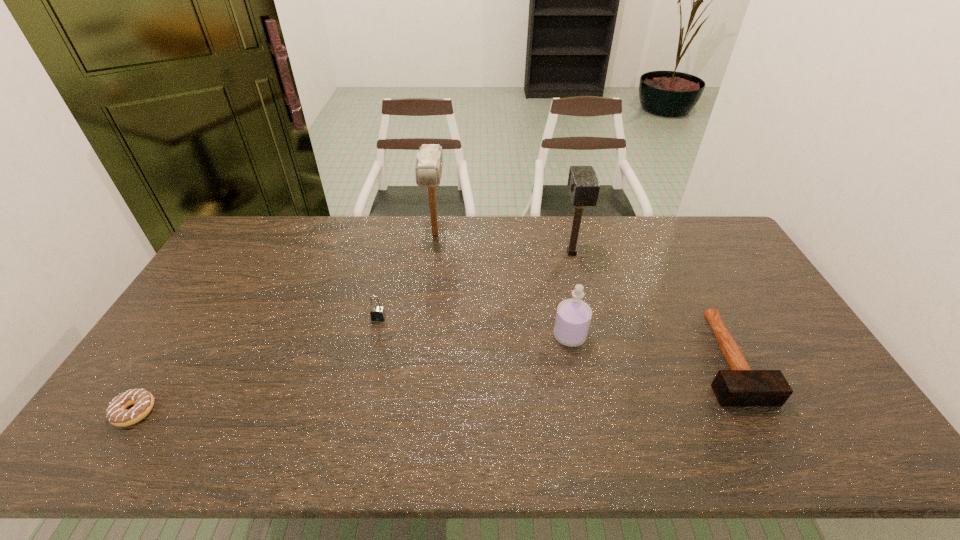
This screenshot has width=960, height=540. What are the coordinates of `empty location between the padlock and the rightmost object` in the screenshot? It's located at (552, 339).

Identify the location of free point between the shortest object and the fourth object from right to left. Image resolution: width=960 pixels, height=540 pixels. (285, 322).

Image resolution: width=960 pixels, height=540 pixels. What are the coordinates of `vacant space in between the leftmost mallet and the fourth shortest object` in the screenshot? It's located at click(502, 285).

You are a GUI agent. You are given a task and a screenshot of the screen. Output one action in this format:
    pyautogui.click(x=<x>, y=<y>)
    Task: Click on the unoccupied position between the second mallet from left to right and the shortest object
    
    Given the screenshot: What is the action you would take?
    pyautogui.click(x=353, y=332)

Identify the location of vacant space that's between the second object from left to right and the shortest mallet. (552, 339).

At what (x,y) coordinates should I click in order to perform the action: click on object that ranks as the third closest to the rightmost object. Please return your answer as a coordinate pair (x, y). Image resolution: width=960 pixels, height=540 pixels. Looking at the image, I should click on (428, 170).

Image resolution: width=960 pixels, height=540 pixels. Find the location of `object that stands as the closest to the perfume`. object that stands as the closest to the perfume is located at coordinates (583, 185).

Where is `the second closest mallet to the leftmost object`? The image size is (960, 540). the second closest mallet to the leftmost object is located at coordinates (583, 185).

Identify which mallet is the closest to the padlock. Please provide its 2D coordinates. Your answer should be formatted as a tuple, i.e. [(x, y)], where the tuple contains the x and y coordinates of a point satisfying the conditions above.

[(428, 170)]

Where is `free space that satisfies the following two spatial constraints: 1. on the striking face of the third object from left to right; 2. on the left side of the second mallet from left to right`? This screenshot has height=540, width=960. free space that satisfies the following two spatial constraints: 1. on the striking face of the third object from left to right; 2. on the left side of the second mallet from left to right is located at coordinates (433, 253).